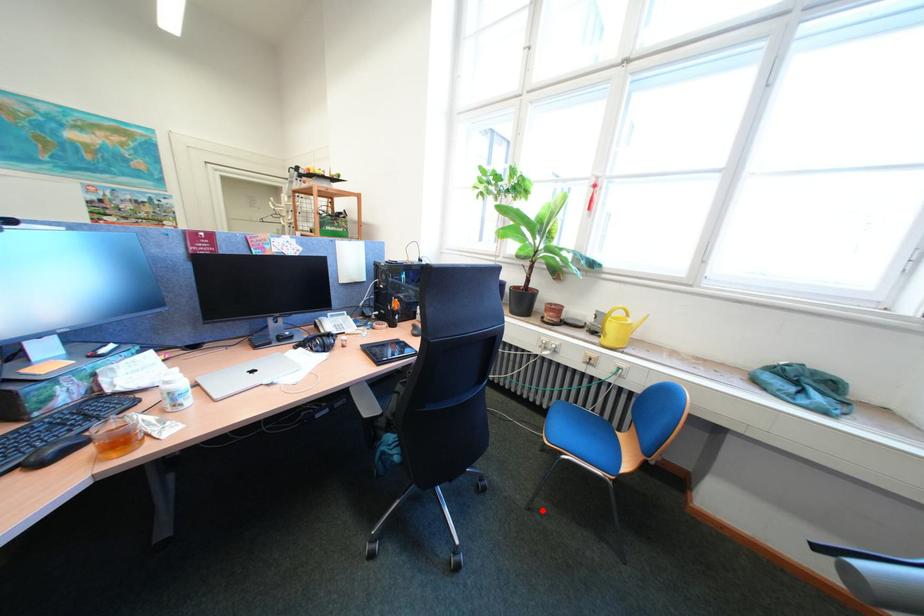
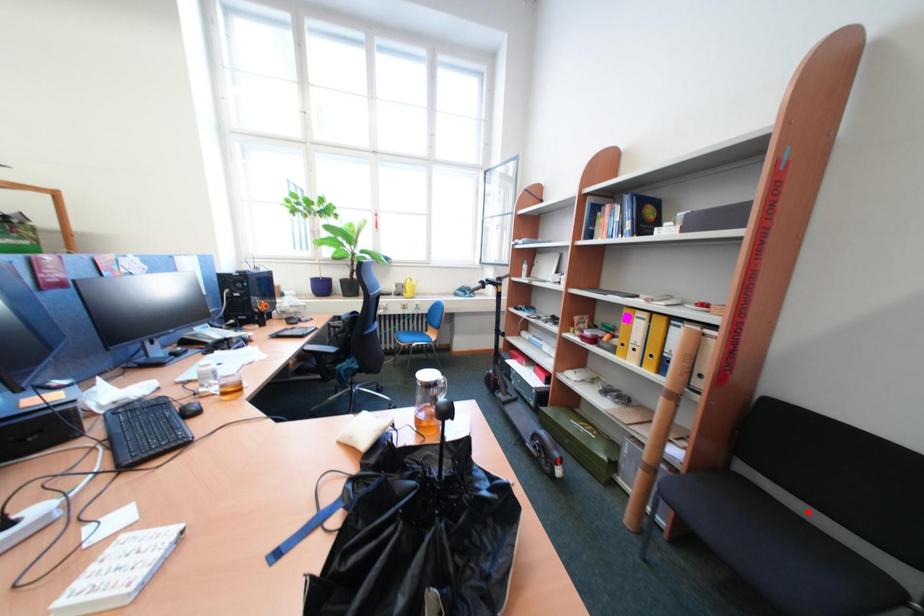
Consider the image. I am providing you with two images of the same scene from different viewpoints. A red point is marked on the first image and another point is marked on the second image. Are the points marked in image1 and image2 representing the same 3D position?

No